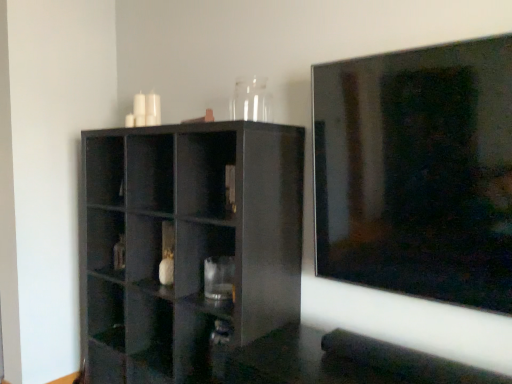
Question: Looking at their shapes, would you say glossy black shelf at center is wider or thinner than transparent glass vase at upper center?

Choices:
 (A) thin
 (B) wide

Answer: (B)

Question: Considering the positions of point (110, 168) and point (254, 114), is point (110, 168) closer or farther from the camera than point (254, 114)?

Choices:
 (A) farther
 (B) closer

Answer: (A)

Question: Considering the relative positions of glossy black shelf at center and transparent glass vase at upper center in the image provided, is glossy black shelf at center to the left or to the right of transparent glass vase at upper center?

Choices:
 (A) right
 (B) left

Answer: (B)

Question: Relative to glossy black shelf at center, is transparent glass vase at upper center in front or behind?

Choices:
 (A) behind
 (B) front

Answer: (A)

Question: Looking at the image, does transparent glass vase at upper center seem bigger or smaller compared to glossy black shelf at center?

Choices:
 (A) big
 (B) small

Answer: (B)

Question: Which is correct: transparent glass vase at upper center is inside glossy black shelf at center, or outside of it?

Choices:
 (A) inside
 (B) outside

Answer: (B)

Question: Considering the positions of transparent glass vase at upper center and glossy black shelf at center in the image, is transparent glass vase at upper center wider or thinner than glossy black shelf at center?

Choices:
 (A) thin
 (B) wide

Answer: (A)